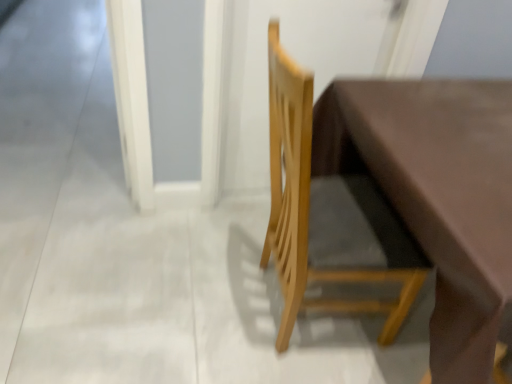
Question: From the image's perspective, is white glossy screen door at lower left over natural wood chair at center?

Choices:
 (A) yes
 (B) no

Answer: (A)

Question: From the image's perspective, is white glossy screen door at lower left located beneath natural wood chair at center?

Choices:
 (A) no
 (B) yes

Answer: (A)

Question: Can you confirm if white glossy screen door at lower left is positioned to the left of natural wood chair at center?

Choices:
 (A) yes
 (B) no

Answer: (A)

Question: Considering the relative sizes of white glossy screen door at lower left and natural wood chair at center in the image provided, is white glossy screen door at lower left smaller than natural wood chair at center?

Choices:
 (A) yes
 (B) no

Answer: (B)

Question: Is white glossy screen door at lower left outside of natural wood chair at center?

Choices:
 (A) yes
 (B) no

Answer: (A)

Question: Considering their positions, is matte brown table at center located in front of or behind white glossy screen door at lower left?

Choices:
 (A) behind
 (B) front

Answer: (B)

Question: Do you think matte brown table at center is within white glossy screen door at lower left, or outside of it?

Choices:
 (A) inside
 (B) outside

Answer: (B)

Question: Visually, is matte brown table at center positioned to the left or to the right of white glossy screen door at lower left?

Choices:
 (A) left
 (B) right

Answer: (B)

Question: From a real-world perspective, is matte brown table at center physically located above or below white glossy screen door at lower left?

Choices:
 (A) below
 (B) above

Answer: (B)

Question: From a real-world perspective, is white glossy screen door at lower left above or below matte brown table at center?

Choices:
 (A) above
 (B) below

Answer: (B)

Question: Looking at their shapes, would you say white glossy screen door at lower left is wider or thinner than matte brown table at center?

Choices:
 (A) wide
 (B) thin

Answer: (A)

Question: Is point (121, 82) closer or farther from the camera than point (485, 261)?

Choices:
 (A) farther
 (B) closer

Answer: (A)

Question: Based on their sizes in the image, would you say white glossy screen door at lower left is bigger or smaller than matte brown table at center?

Choices:
 (A) small
 (B) big

Answer: (A)

Question: From their relative heights in the image, would you say natural wood chair at center is taller or shorter than white glossy screen door at lower left?

Choices:
 (A) short
 (B) tall

Answer: (B)

Question: Based on their sizes in the image, would you say natural wood chair at center is bigger or smaller than white glossy screen door at lower left?

Choices:
 (A) big
 (B) small

Answer: (B)